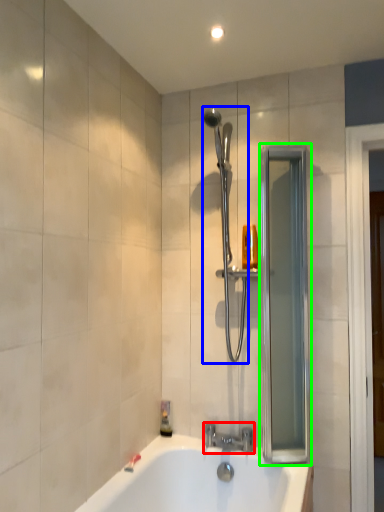
Question: Considering the real-world distances, which object is farthest from tap (highlighted by a red box)? shower (highlighted by a blue box) or screen door (highlighted by a green box)?

Choices:
 (A) shower
 (B) screen door

Answer: (A)